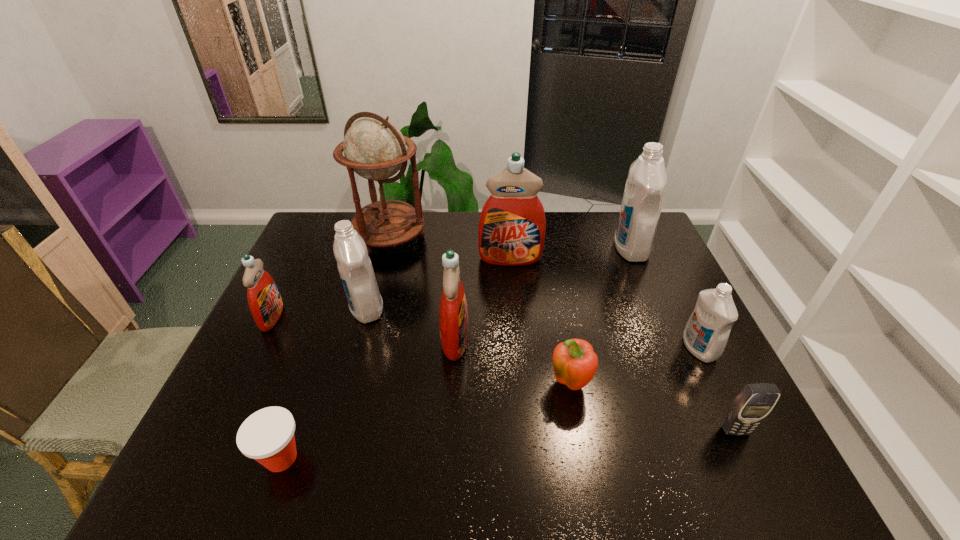
Identify the location of the tallest object. This screenshot has width=960, height=540. (374, 148).

Find the location of a particular element. Image resolution: width=960 pixels, height=540 pixels. the farthest white detergent is located at coordinates (x=644, y=191).

Locate an element on the screen. the farthest red detergent is located at coordinates (512, 225).

In order to click on the biggest red detergent in this screenshot , I will do `click(512, 225)`.

Identify the location of the second biggest white detergent. The height and width of the screenshot is (540, 960). (355, 268).

Locate an element on the screen. The image size is (960, 540). the second nearest white detergent is located at coordinates pyautogui.click(x=355, y=268).

The height and width of the screenshot is (540, 960). I want to click on the fifth object from left to right, so click(453, 315).

Where is `the second smallest red detergent`? the second smallest red detergent is located at coordinates (453, 315).

In order to click on the smallest white detergent in this screenshot , I will do (706, 333).

At what (x,y) coordinates should I click in order to perform the action: click on the leftmost red detergent. Please return your answer as a coordinate pair (x, y). Looking at the image, I should click on (265, 303).